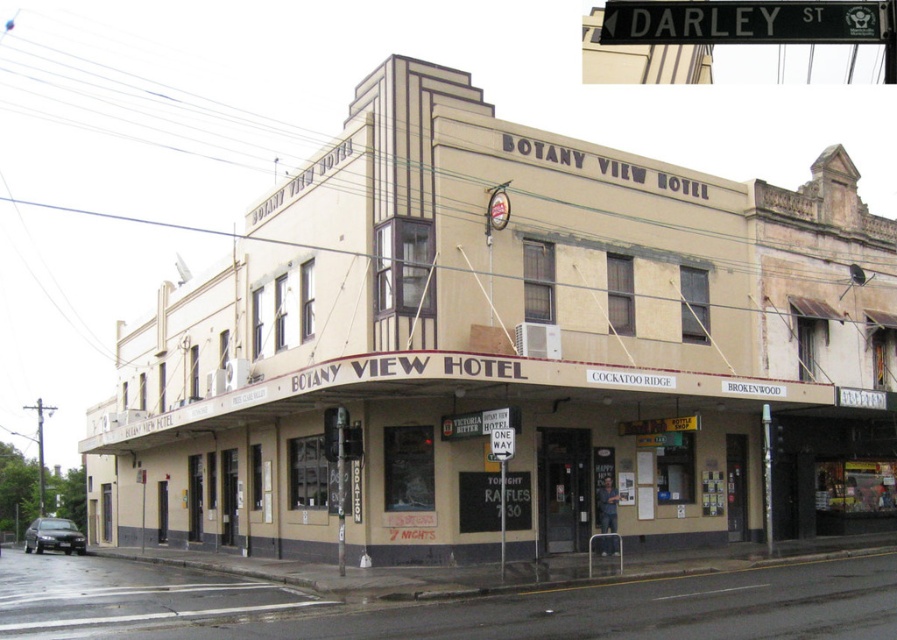
You are standing in front of the Botany View Hotel and want to take a photo of the beige textured building at center and the black metal street sign at upper center. Which object should you focus on first if you want both to be in sharp focus?

The beige textured building at center is further to the viewer than the black metal street sign at upper center. To have both in sharp focus, focus on the black metal street sign at upper center since it is closer, ensuring the building in the background is also in focus.

You are a delivery driver approaching the Botany View Hotel. You need to park your vehicle in a spot that allows you to see both the beige textured building at center and the black metal street sign at upper center clearly. Given their sizes, which object will occupy more of your windshield view?

The beige textured building at center occupies more of the windshield view because it has a larger size compared to the black metal street sign at upper center.

From the picture: You are a delivery driver approaching the Botany View Hotel. You need to park your van, which is 2.5 meters wide, in front of the beige textured building at center. The parking spot next to the black metal street sign at upper center is available. Can your van fit there without blocking the sign?

The beige textured building at center might be wider than the black metal street sign at upper center, but the description does not provide exact measurements. Therefore, it is uncertain if the van will fit without blocking the sign. Check the actual width of the parking spot before deciding.